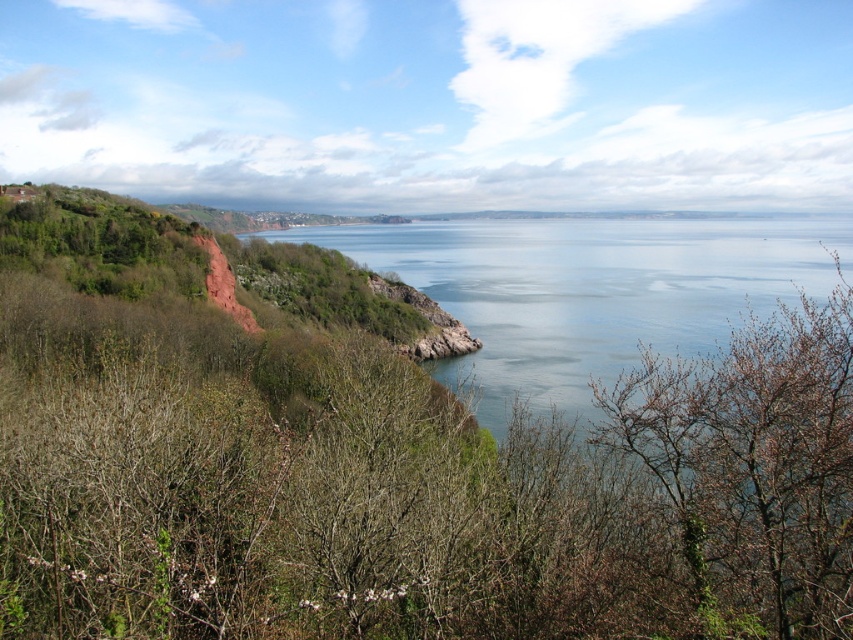
From the picture: Between blue water at center and bare branches at center, which one has more height?

blue water at center is taller.

Can you confirm if blue water at center is positioned to the right of bare branches at center?

Indeed, blue water at center is positioned on the right side of bare branches at center.

Which is in front, point (694, 230) or point (683, 394)?

Positioned in front is point (683, 394).

The width and height of the screenshot is (853, 640). Identify the location of blue water at center. (590, 291).